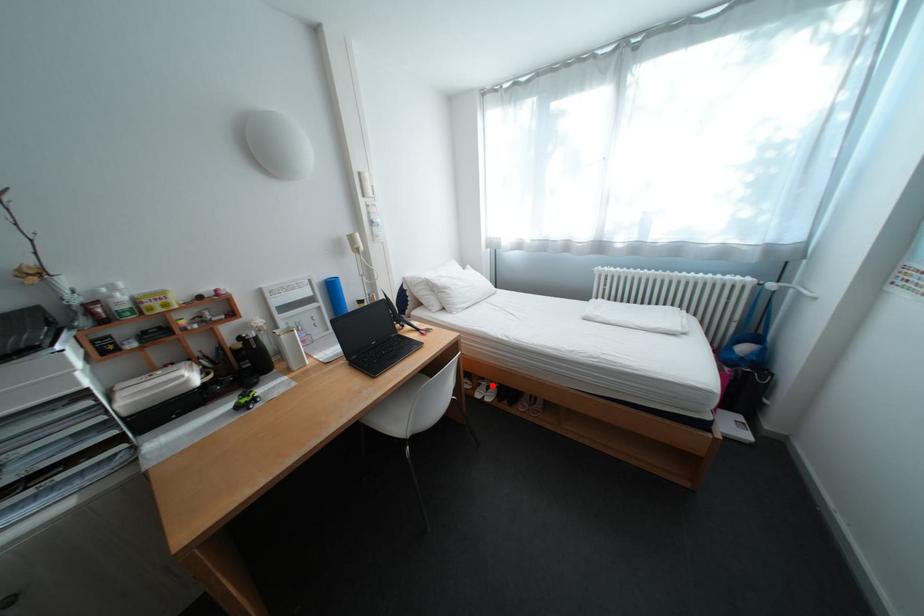
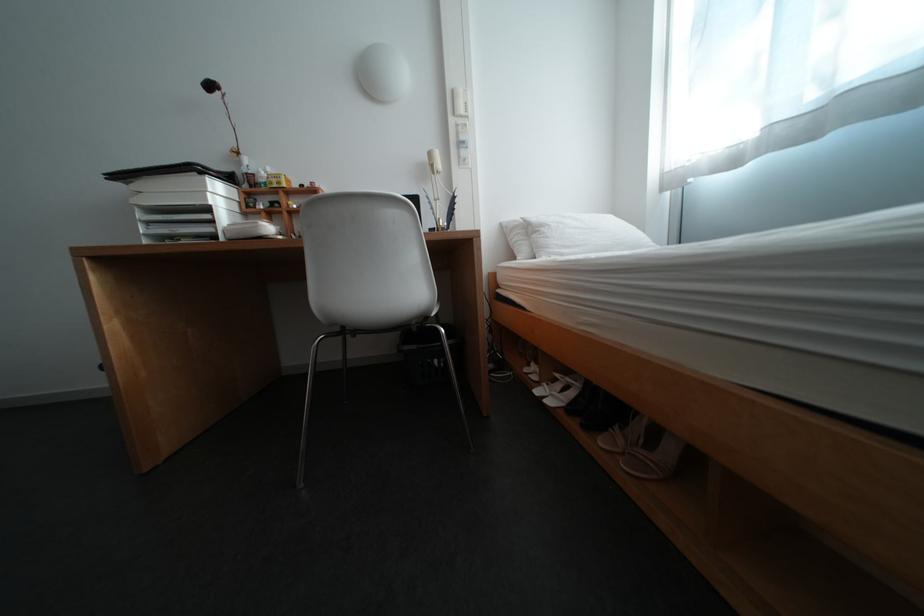
Where in the second image is the point corresponding to the highlighted location from the first image?

(568, 381)